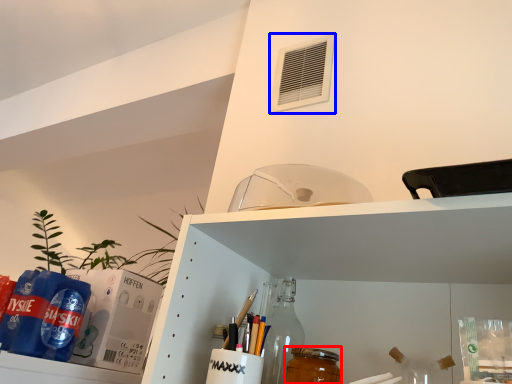
Question: Which of the following is the farthest to the observer, beverage (highlighted by a red box) or air conditioning (highlighted by a blue box)?

Choices:
 (A) beverage
 (B) air conditioning

Answer: (B)